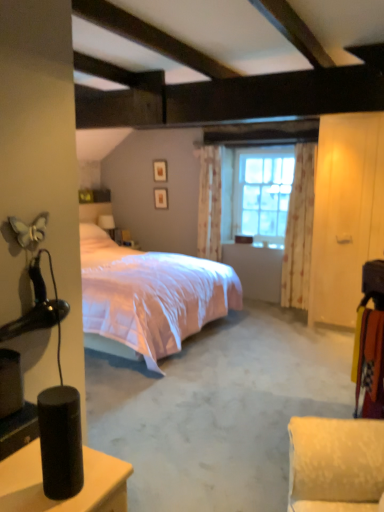
Describe the element at coordinates (209, 203) in the screenshot. This screenshot has width=384, height=512. I see `floral fabric curtain at center, which is counted as the second curtain, starting from the right` at that location.

The image size is (384, 512). Identify the location of pink satin bed at center. (146, 295).

Looking at this image, what is the approximate width of matte wooden picture frame at upper center, which ranks as the 2th picture frame in top-to-bottom order?

The width of matte wooden picture frame at upper center, which ranks as the 2th picture frame in top-to-bottom order, is 1.82 inches.

Describe the element at coordinates (161, 198) in the screenshot. This screenshot has width=384, height=512. I see `matte wooden picture frame at upper center, which ranks as the 2th picture frame in top-to-bottom order` at that location.

Locate an element on the screen. The width and height of the screenshot is (384, 512). floral fabric curtain at center, which is counted as the second curtain, starting from the right is located at coordinates (209, 203).

From the image's perspective, is pink satin bed at center over floral fabric curtain at right, the 1th curtain from the front?

No.

From a real-world perspective, is pink satin bed at center physically located above or below floral fabric curtain at right, the 2th curtain when ordered from left to right?

pink satin bed at center is situated lower than floral fabric curtain at right, the 2th curtain when ordered from left to right, in the real world.

Is pink satin bed at center facing towards floral fabric curtain at right, which ranks as the first curtain in right-to-left order?

No, pink satin bed at center does not turn towards floral fabric curtain at right, which ranks as the first curtain in right-to-left order.

Is matte wooden picture frame at upper center, which ranks as the first picture frame in bottom-to-top order, to the left or to the right of clear glass window at center in the image?

matte wooden picture frame at upper center, which ranks as the first picture frame in bottom-to-top order, is to the left of clear glass window at center.

Identify the location of window below the matte wooden picture frame at upper center, which ranks as the first picture frame in bottom-to-top order (from the image's perspective). This screenshot has width=384, height=512. (256, 192).

Is matte wooden picture frame at upper center, which ranks as the 2th picture frame in top-to-bottom order, bigger than clear glass window at center?

No, matte wooden picture frame at upper center, which ranks as the 2th picture frame in top-to-bottom order, is not bigger than clear glass window at center.

Would you say clear glass window at center is part of matte wooden picture frame at upper center, which ranks as the first picture frame in bottom-to-top order,'s contents?

No, clear glass window at center is not inside matte wooden picture frame at upper center, which ranks as the first picture frame in bottom-to-top order.

Who is taller, matte wooden picture frame at upper center, placed as the 1th picture frame when sorted from top to bottom, or clear glass window at center?

clear glass window at center.

Considering the sizes of objects matte wooden picture frame at upper center, the second picture frame positioned from the bottom, and clear glass window at center in the image provided, who is wider, matte wooden picture frame at upper center, the second picture frame positioned from the bottom, or clear glass window at center?

With larger width is clear glass window at center.

Considering the relative positions of matte wooden picture frame at upper center, placed as the 1th picture frame when sorted from top to bottom, and clear glass window at center in the image provided, is matte wooden picture frame at upper center, placed as the 1th picture frame when sorted from top to bottom, behind clear glass window at center?

Yes, matte wooden picture frame at upper center, placed as the 1th picture frame when sorted from top to bottom, is further from the camera.

Which point is more forward, (153,161) or (237,231)?

The point (237,231) is closer.

Does floral fabric curtain at center, arranged as the 1th curtain when viewed from the back, come behind matte white table lamp at center?

No.

From a real-world perspective, is floral fabric curtain at center, which appears as the 1th curtain when viewed from the left, physically above matte white table lamp at center?

Correct, in the physical world, floral fabric curtain at center, which appears as the 1th curtain when viewed from the left, is higher than matte white table lamp at center.

Is floral fabric curtain at center, the 2th curtain from the front, oriented towards matte white table lamp at center?

No, floral fabric curtain at center, the 2th curtain from the front, does not turn towards matte white table lamp at center.

Is floral fabric curtain at center, which appears as the 1th curtain when viewed from the left, thinner than matte white table lamp at center?

Yes.

Find the location of a particular element. Image resolution: width=384 pixels, height=512 pixels. window located on the left of floral fabric curtain at right, which ranks as the second curtain in back-to-front order is located at coordinates (256, 192).

In the image, is floral fabric curtain at right, the 1th curtain from the front, on the left side or the right side of clear glass window at center?

floral fabric curtain at right, the 1th curtain from the front, is positioned on clear glass window at center's right side.

Which of these two, floral fabric curtain at right, which ranks as the first curtain in right-to-left order, or clear glass window at center, is bigger?

clear glass window at center.

Is point (311, 237) positioned in front of point (258, 175)?

Yes, point (311, 237) is closer to viewer.

Consider the image. Are matte wooden picture frame at upper center, placed as the 1th picture frame when sorted from top to bottom, and floral fabric curtain at center, arranged as the 1th curtain when viewed from the back, far apart?

No, matte wooden picture frame at upper center, placed as the 1th picture frame when sorted from top to bottom, is not far away from floral fabric curtain at center, arranged as the 1th curtain when viewed from the back.

Which object is more forward, matte wooden picture frame at upper center, placed as the 1th picture frame when sorted from top to bottom, or floral fabric curtain at center, which appears as the 1th curtain when viewed from the left?

floral fabric curtain at center, which appears as the 1th curtain when viewed from the left, is in front.

Can you confirm if matte wooden picture frame at upper center, the second picture frame positioned from the bottom, is positioned to the right of floral fabric curtain at center, the 2th curtain from the front?

In fact, matte wooden picture frame at upper center, the second picture frame positioned from the bottom, is to the left of floral fabric curtain at center, the 2th curtain from the front.

Is matte wooden picture frame at upper center, the second picture frame positioned from the bottom, positioned with its back to floral fabric curtain at center, the 2th curtain from the front?

matte wooden picture frame at upper center, the second picture frame positioned from the bottom, is not turned away from floral fabric curtain at center, the 2th curtain from the front.

Is clear glass window at center next to matte white table lamp at center and touching it?

No.

Considering the sizes of objects clear glass window at center and matte white table lamp at center in the image provided, who is bigger, clear glass window at center or matte white table lamp at center?

clear glass window at center is bigger.

Considering the points (254, 215) and (102, 228), which point is behind, point (254, 215) or point (102, 228)?

Point (102, 228)

Is clear glass window at center facing towards matte white table lamp at center?

No, clear glass window at center is not turned towards matte white table lamp at center.

Identify the location of bed below the floral fabric curtain at right, the 2th curtain when ordered from left to right (from the image's perspective). (146, 295).

In order to click on window located above the matte wooden picture frame at upper center, which ranks as the first picture frame in bottom-to-top order (from a real-world perspective) in this screenshot , I will do `click(256, 192)`.

Based on their spatial positions, is matte white table lamp at center or floral fabric curtain at right, which ranks as the second curtain in back-to-front order, further from pink satin bed at center?

Based on the image, matte white table lamp at center appears to be further to pink satin bed at center.

Considering their positions, is matte white table lamp at center positioned further to floral fabric curtain at right, which ranks as the first curtain in right-to-left order, than floral fabric curtain at center, arranged as the 1th curtain when viewed from the back?

The object further to floral fabric curtain at right, which ranks as the first curtain in right-to-left order, is matte white table lamp at center.

From the image, which object appears to be farther from matte wooden picture frame at upper center, which ranks as the first picture frame in bottom-to-top order, floral fabric curtain at center, the 2th curtain from the front, or clear glass window at center?

Based on the image, clear glass window at center appears to be further to matte wooden picture frame at upper center, which ranks as the first picture frame in bottom-to-top order.

From the image, which object appears to be nearer to clear glass window at center, floral fabric curtain at right, which ranks as the second curtain in back-to-front order, or pink satin bed at center?

floral fabric curtain at right, which ranks as the second curtain in back-to-front order, is closer to clear glass window at center.

Based on their spatial positions, is clear glass window at center or floral fabric curtain at center, which is counted as the second curtain, starting from the right, further from floral fabric curtain at right, the 2th curtain when ordered from left to right?

floral fabric curtain at center, which is counted as the second curtain, starting from the right, is positioned further to the anchor floral fabric curtain at right, the 2th curtain when ordered from left to right.

Considering their positions, is clear glass window at center positioned further to matte white table lamp at center than floral fabric curtain at center, which is counted as the second curtain, starting from the right?

clear glass window at center lies further to matte white table lamp at center than the other object.

Looking at the image, which one is located closer to floral fabric curtain at right, the 2th curtain when ordered from left to right, matte wooden picture frame at upper center, which ranks as the 2th picture frame in top-to-bottom order, or floral fabric curtain at center, which appears as the 1th curtain when viewed from the left?

The object closer to floral fabric curtain at right, the 2th curtain when ordered from left to right, is floral fabric curtain at center, which appears as the 1th curtain when viewed from the left.

When comparing their distances from matte white table lamp at center, does pink satin bed at center or clear glass window at center seem closer?

clear glass window at center is positioned closer to the anchor matte white table lamp at center.

This screenshot has height=512, width=384. Identify the location of window between pink satin bed at center and matte white table lamp at center along the z-axis. (256, 192).

This screenshot has height=512, width=384. What are the coordinates of `picture frame located between floral fabric curtain at center, which appears as the 1th curtain when viewed from the left, and matte wooden picture frame at upper center, which ranks as the 2th picture frame in top-to-bottom order, in the depth direction` in the screenshot? It's located at (160, 170).

Identify the location of window between pink satin bed at center and matte wooden picture frame at upper center, placed as the 1th picture frame when sorted from top to bottom, from front to back. (256, 192).

Locate an element on the screen. picture frame between matte wooden picture frame at upper center, the second picture frame positioned from the bottom, and clear glass window at center from left to right is located at coordinates (161, 198).